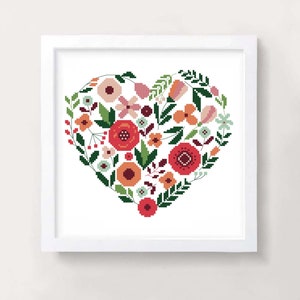
I want to click on embroidery, so coord(169,171).